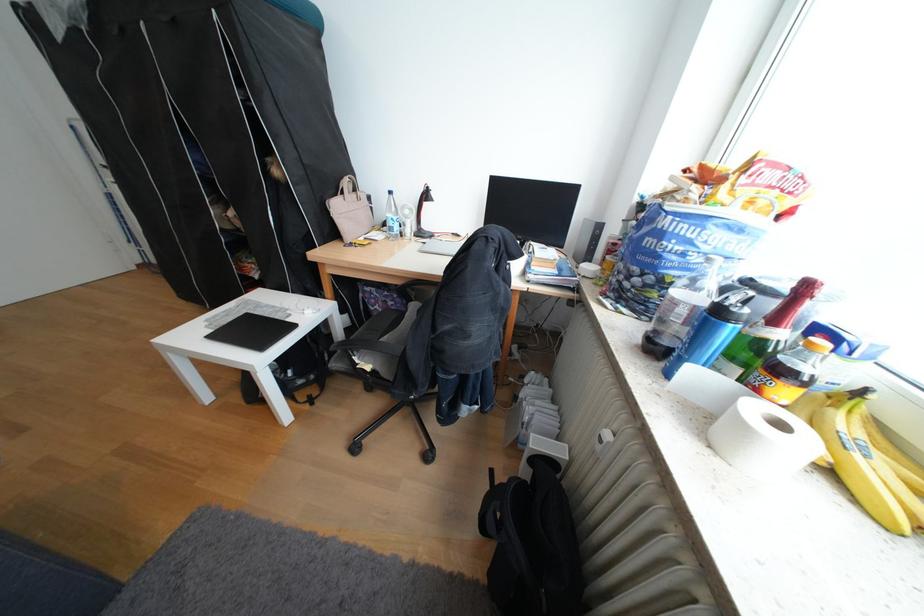
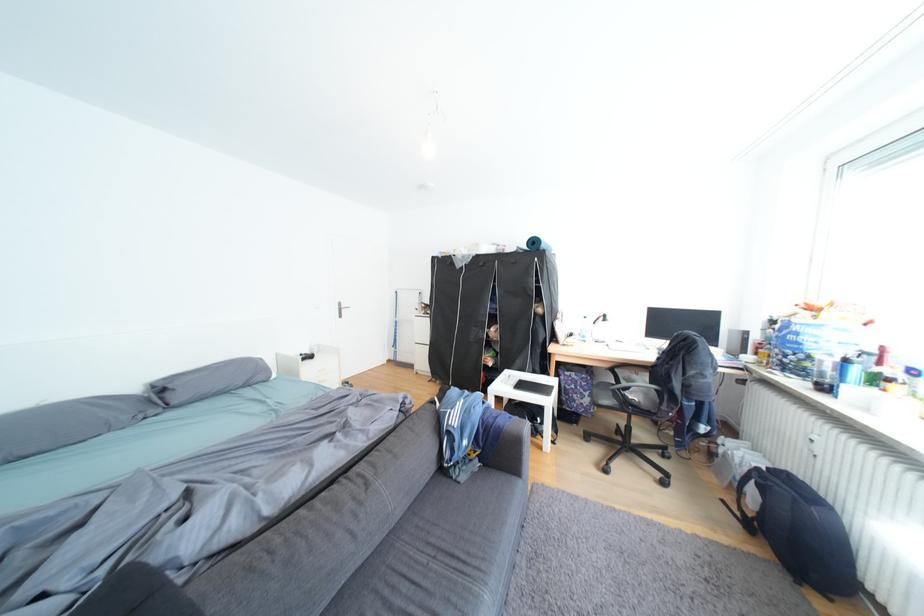
In the second image, find the point that corresponds to pixel 270 277 in the first image.

(504, 365)